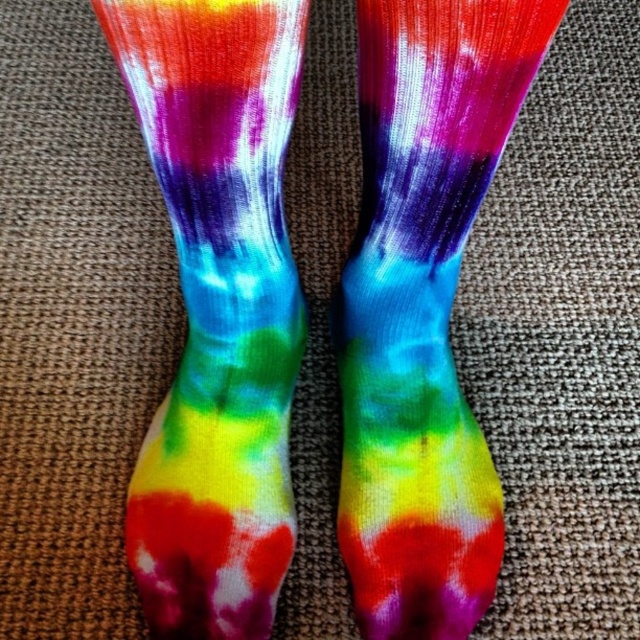
You are looking at the socks and notice two points marked on them. The first point is at coordinate point (x=147, y=35) and the second is at point (x=428, y=262). Which point is closer to you?

Point (x=147, y=35) is in front of point (x=428, y=262), so the first point is closer to you.